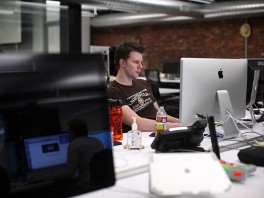
Locate an element on the screen. This screenshot has width=264, height=198. hand sanitizer is located at coordinates (134, 123).